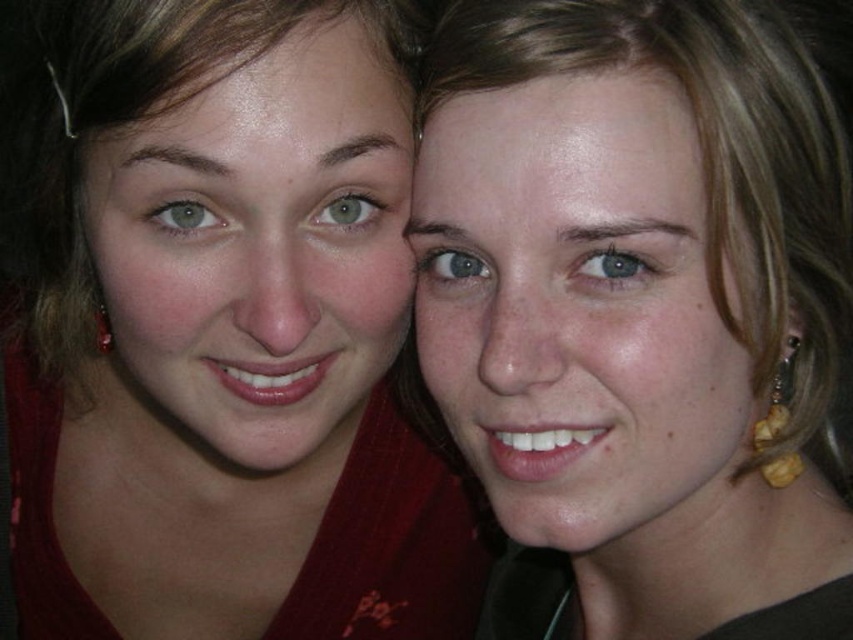
You are a photographer trying to capture a closeup shot of both the matte red shirt at left and the matte gold earrings at right. Given that your camera can only focus on objects within a 6 inch range, will you be able to focus on both items simultaneously?

The distance between the matte red shirt at left and the matte gold earrings at right is 6.86 inches, which exceeds the camera focus range of 6 inches. Therefore, both items cannot be in focus at the same time.

You are a photographer trying to focus on the matte red shirt at left. What are the coordinates where you should aim your camera?

The coordinates to focus on the matte red shirt at left are at point (x=224, y=333).

In the photo, there are two people. The person on the left is wearing a matte red shirt at left, and the person on the right has matte gold earrings at right. Which item is positioned more to the left side of the image?

The matte red shirt at left is positioned more to the left side of the image than the matte gold earrings at right.